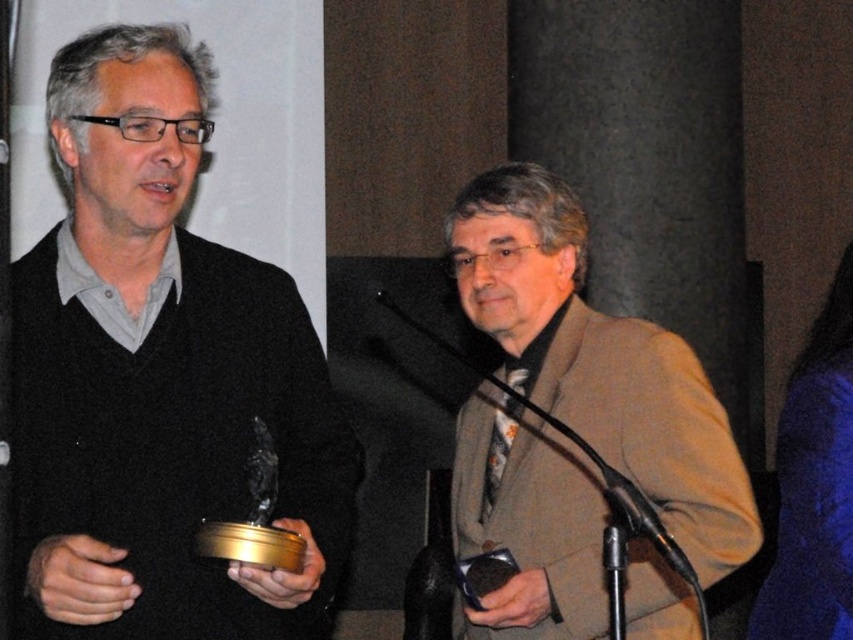
You are a photographer at the event and need to capture a clear photo of the matte black sweater at left and the black metallic microphone at center. Which object should you focus on first to ensure both are in focus?

The matte black sweater at left is in front of the black metallic microphone at center, so you should focus on the matte black sweater at left first to ensure both are in focus.

You are standing at the center of the venue and want to move towards the point that is closer to you. Which point should you move towards, point (196, 337) or point (692, 563)?

Point (196, 337) is in front of point (692, 563), so you should move towards point (196, 337) as it is closer to you.